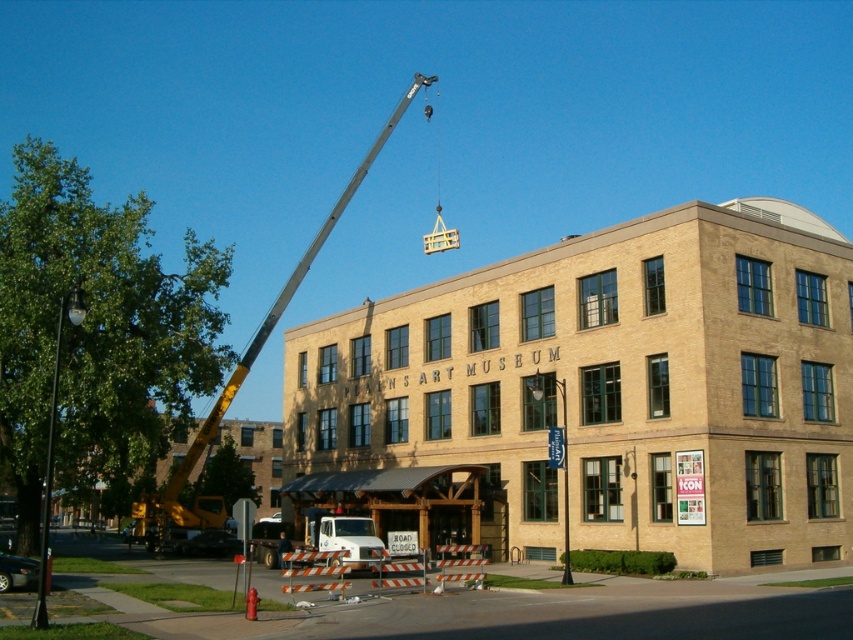
You are standing at the point marked as point (612, 387) in the image. Which object is directly in front of you?

The beige brick building at center is directly in front of you at point (612, 387).

You are standing outside the PlainsArt Museum construction site and want to take a photo of the beige brick building at center. If the recommended safe distance for photography is 100 feet, is the current distance sufficient?

The distance between you and the beige brick building at center is 111.17 feet, which exceeds the recommended safe distance of 100 feet. Therefore, the current distance is sufficient for taking the photo safely.

You are an architect visiting the PlainsArt Museum construction site. You notice the beige brick building at center and the white plastic lift at center. Which structure is bigger in size?

The beige brick building at center is larger in size compared to the white plastic lift at center.